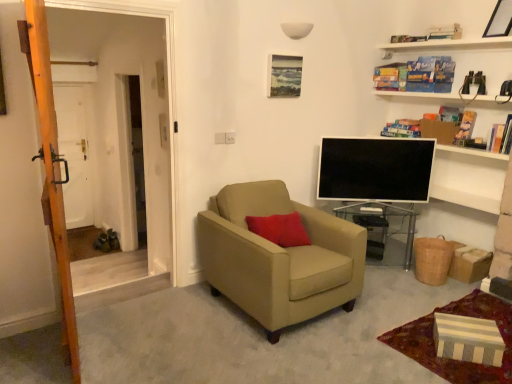
You are a GUI agent. You are given a task and a screenshot of the screen. Output one action in this format:
    pyautogui.click(x=<x>, y=<y>)
    Task: Click on the free space behind wooden ladder at left
    The height and width of the screenshot is (384, 512).
    Given the screenshot: What is the action you would take?
    pyautogui.click(x=117, y=314)